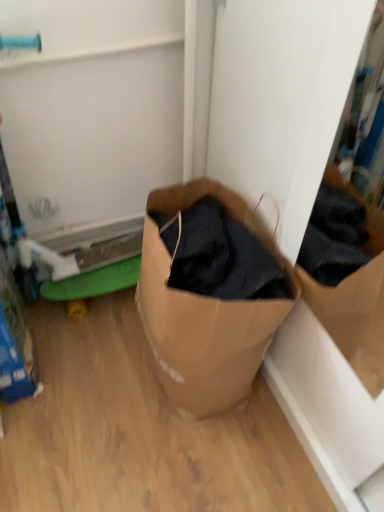
What are the coordinates of `vacant space that is in between brown paper bag at center and green rubber toy at lower left` in the screenshot? It's located at (110, 355).